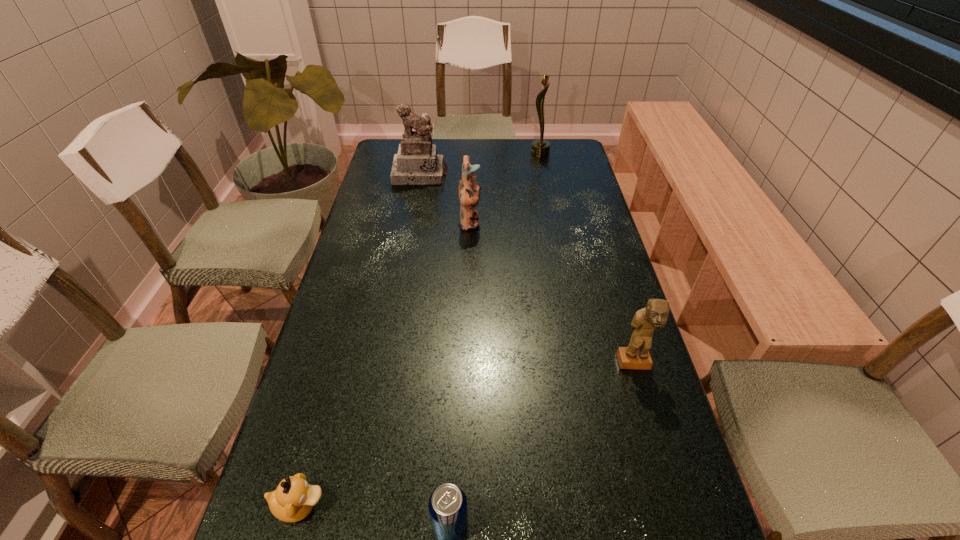
Where is `award present at the right edge`? This screenshot has height=540, width=960. award present at the right edge is located at coordinates tap(540, 148).

In order to click on figurine that is positioned at the right edge in this screenshot , I will do `click(636, 356)`.

Where is `object situated at the far left corner`? object situated at the far left corner is located at coordinates point(417,163).

Identify the location of object located in the far right corner section of the desktop. The width and height of the screenshot is (960, 540). (540, 148).

You are a GUI agent. You are given a task and a screenshot of the screen. Output one action in this format:
    pyautogui.click(x=<x>, y=<y>)
    Task: Click on the blank space at the far edge of the desktop
    The width and height of the screenshot is (960, 540).
    Given the screenshot: What is the action you would take?
    pyautogui.click(x=505, y=145)

Where is `vacant space at the left edge`? vacant space at the left edge is located at coordinates (342, 407).

The height and width of the screenshot is (540, 960). Find the location of `vacant space at the right edge of the desktop`. vacant space at the right edge of the desktop is located at coordinates (593, 220).

Where is `vacant space at the far left corner of the desktop`? The width and height of the screenshot is (960, 540). vacant space at the far left corner of the desktop is located at coordinates (395, 139).

The width and height of the screenshot is (960, 540). In order to click on free area in between the duckling and the award in this screenshot , I will do `click(420, 329)`.

Where is `vacant area that lies between the shortest object and the rightmost object`? This screenshot has height=540, width=960. vacant area that lies between the shortest object and the rightmost object is located at coordinates (468, 434).